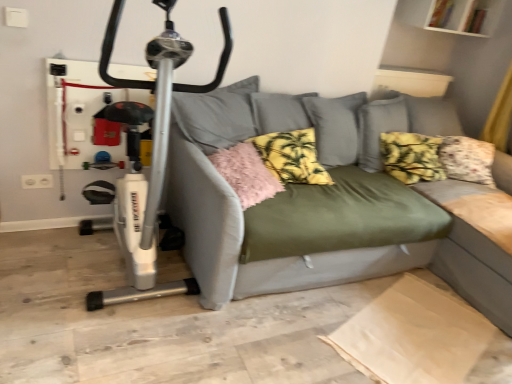
Image resolution: width=512 pixels, height=384 pixels. I want to click on olive green fabric couch at center, so click(328, 203).

Based on their sizes in the image, would you say yellow floral cushion at center, which ranks as the first pillow in right-to-left order, is bigger or smaller than pink fluffy pillow at center, which ranks as the first pillow in left-to-right order?

Clearly, yellow floral cushion at center, which ranks as the first pillow in right-to-left order, is larger in size than pink fluffy pillow at center, which ranks as the first pillow in left-to-right order.

Is yellow floral cushion at center, which ranks as the first pillow in right-to-left order, completely or partially outside of pink fluffy pillow at center, which ranks as the first pillow in left-to-right order?

Indeed, yellow floral cushion at center, which ranks as the first pillow in right-to-left order, is completely outside pink fluffy pillow at center, which ranks as the first pillow in left-to-right order.

From a real-world perspective, who is located higher, yellow floral cushion at center, which is counted as the third pillow, starting from the left, or pink fluffy pillow at center, which ranks as the first pillow in left-to-right order?

yellow floral cushion at center, which is counted as the third pillow, starting from the left, from a real-world perspective.

Is yellow floral cushion at center, which is counted as the third pillow, starting from the left, turned away from pink fluffy pillow at center, arranged as the 3th pillow when viewed from the right?

No, pink fluffy pillow at center, arranged as the 3th pillow when viewed from the right, is not at the back of yellow floral cushion at center, which is counted as the third pillow, starting from the left.

Which of these two, pink fluffy pillow at center, arranged as the 3th pillow when viewed from the right, or yellow floral cushion at center, which is counted as the third pillow, starting from the left, is wider?

With larger width is pink fluffy pillow at center, arranged as the 3th pillow when viewed from the right.

Is pink fluffy pillow at center, arranged as the 3th pillow when viewed from the right, with yellow floral cushion at center, which ranks as the first pillow in right-to-left order?

There is a gap between pink fluffy pillow at center, arranged as the 3th pillow when viewed from the right, and yellow floral cushion at center, which ranks as the first pillow in right-to-left order.

What's the angular difference between pink fluffy pillow at center, arranged as the 3th pillow when viewed from the right, and yellow floral cushion at center, which ranks as the first pillow in right-to-left order,'s facing directions?

19.8 degrees.

Does pink fluffy pillow at center, which ranks as the first pillow in left-to-right order, turn towards yellow floral cushion at center, which ranks as the first pillow in right-to-left order?

No, pink fluffy pillow at center, which ranks as the first pillow in left-to-right order, is not facing towards yellow floral cushion at center, which ranks as the first pillow in right-to-left order.

Measure the distance from white plastic exercise bike at left to olive green fabric couch at center.

A distance of 1.05 meters exists between white plastic exercise bike at left and olive green fabric couch at center.

In the scene shown: Is white plastic exercise bike at left in contact with olive green fabric couch at center?

white plastic exercise bike at left and olive green fabric couch at center are not in contact.

Which is less distant, (177, 66) or (284, 222)?

The point (284, 222) is closer to the camera.

Considering the relative sizes of white plastic exercise bike at left and olive green fabric couch at center in the image provided, is white plastic exercise bike at left shorter than olive green fabric couch at center?

No, white plastic exercise bike at left is not shorter than olive green fabric couch at center.

Looking at their sizes, would you say olive green fabric couch at center is wider or thinner than pink fluffy pillow at center, which ranks as the first pillow in left-to-right order?

Considering their sizes, olive green fabric couch at center looks broader than pink fluffy pillow at center, which ranks as the first pillow in left-to-right order.

From the image's perspective, which is above, olive green fabric couch at center or pink fluffy pillow at center, which ranks as the first pillow in left-to-right order?

pink fluffy pillow at center, which ranks as the first pillow in left-to-right order, is shown above in the image.

Does point (294, 109) lie behind point (265, 179)?

Yes, point (294, 109) is farther from viewer.

Is olive green fabric couch at center beside pink fluffy pillow at center, arranged as the 3th pillow when viewed from the right?

olive green fabric couch at center and pink fluffy pillow at center, arranged as the 3th pillow when viewed from the right, are not in contact.

Considering the relative sizes of yellow printed fabric pillow at center, which ranks as the second pillow in right-to-left order, and white plastic exercise bike at left in the image provided, is yellow printed fabric pillow at center, which ranks as the second pillow in right-to-left order, thinner than white plastic exercise bike at left?

Yes, yellow printed fabric pillow at center, which ranks as the second pillow in right-to-left order, is thinner than white plastic exercise bike at left.

Is white plastic exercise bike at left at the back of yellow printed fabric pillow at center, which appears as the second pillow when viewed from the left?

yellow printed fabric pillow at center, which appears as the second pillow when viewed from the left, is not turned away from white plastic exercise bike at left.

From a real-world perspective, is yellow printed fabric pillow at center, which appears as the second pillow when viewed from the left, on top of white plastic exercise bike at left?

Actually, yellow printed fabric pillow at center, which appears as the second pillow when viewed from the left, is physically below white plastic exercise bike at left in the real world.

Does yellow printed fabric pillow at center, which ranks as the second pillow in right-to-left order, have a larger size compared to white plastic exercise bike at left?

No.

Which object is thinner, yellow printed fabric pillow at center, which appears as the second pillow when viewed from the left, or yellow floral cushion at center, which ranks as the first pillow in right-to-left order?

Thinner between the two is yellow floral cushion at center, which ranks as the first pillow in right-to-left order.

Is point (260, 139) positioned in front of point (400, 175)?

That is True.

The image size is (512, 384). Identify the location of pillow located on the right of yellow printed fabric pillow at center, which appears as the second pillow when viewed from the left. (411, 157).

From the picture: Would you say pink fluffy pillow at center, which ranks as the first pillow in left-to-right order, is outside yellow printed fabric pillow at center, which appears as the second pillow when viewed from the left?

Indeed, pink fluffy pillow at center, which ranks as the first pillow in left-to-right order, is completely outside yellow printed fabric pillow at center, which appears as the second pillow when viewed from the left.

From a real-world perspective, is pink fluffy pillow at center, arranged as the 3th pillow when viewed from the right, located higher than yellow printed fabric pillow at center, which appears as the second pillow when viewed from the left?

Actually, pink fluffy pillow at center, arranged as the 3th pillow when viewed from the right, is physically below yellow printed fabric pillow at center, which appears as the second pillow when viewed from the left, in the real world.

Is pink fluffy pillow at center, arranged as the 3th pillow when viewed from the right, smaller than yellow printed fabric pillow at center, which ranks as the second pillow in right-to-left order?

Yes.

From the image's perspective, count 2nd pillows upward from the pink fluffy pillow at center, arranged as the 3th pillow when viewed from the right, and point to it. Please provide its 2D coordinates.

[(411, 157)]

From the pink fluffy pillow at center, which ranks as the first pillow in left-to-right order, count 2nd pillow to the right and point to it. Please provide its 2D coordinates.

[(411, 157)]

Estimate the real-world distances between objects in this image. Which object is closer to yellow floral cushion at center, which is counted as the third pillow, starting from the left, pink fluffy pillow at center, arranged as the 3th pillow when viewed from the right, or olive green fabric couch at center?

olive green fabric couch at center.

Based on their spatial positions, is white plastic exercise bike at left or yellow floral cushion at center, which ranks as the first pillow in right-to-left order, further from pink fluffy pillow at center, arranged as the 3th pillow when viewed from the right?

yellow floral cushion at center, which ranks as the first pillow in right-to-left order.

Looking at the image, which one is located closer to yellow floral cushion at center, which is counted as the third pillow, starting from the left, white plastic exercise bike at left or olive green fabric couch at center?

olive green fabric couch at center lies closer to yellow floral cushion at center, which is counted as the third pillow, starting from the left, than the other object.

Looking at this image, when comparing their distances from yellow floral cushion at center, which is counted as the third pillow, starting from the left, does olive green fabric couch at center or pink fluffy pillow at center, arranged as the 3th pillow when viewed from the right, seem closer?

Based on the image, olive green fabric couch at center appears to be nearer to yellow floral cushion at center, which is counted as the third pillow, starting from the left.

Based on their spatial positions, is white plastic exercise bike at left or olive green fabric couch at center closer to yellow printed fabric pillow at center, which appears as the second pillow when viewed from the left?

olive green fabric couch at center is closer to yellow printed fabric pillow at center, which appears as the second pillow when viewed from the left.

Based on the photo, which object lies nearer to the anchor point yellow printed fabric pillow at center, which appears as the second pillow when viewed from the left, white plastic exercise bike at left or yellow floral cushion at center, which is counted as the third pillow, starting from the left?

yellow floral cushion at center, which is counted as the third pillow, starting from the left.

Considering their positions, is pink fluffy pillow at center, which ranks as the first pillow in left-to-right order, positioned closer to yellow printed fabric pillow at center, which appears as the second pillow when viewed from the left, than yellow floral cushion at center, which is counted as the third pillow, starting from the left?

pink fluffy pillow at center, which ranks as the first pillow in left-to-right order, is closer to yellow printed fabric pillow at center, which appears as the second pillow when viewed from the left.

Considering their positions, is yellow printed fabric pillow at center, which appears as the second pillow when viewed from the left, positioned further to yellow floral cushion at center, which ranks as the first pillow in right-to-left order, than pink fluffy pillow at center, arranged as the 3th pillow when viewed from the right?

pink fluffy pillow at center, arranged as the 3th pillow when viewed from the right, is further to yellow floral cushion at center, which ranks as the first pillow in right-to-left order.

Locate an element on the screen. The width and height of the screenshot is (512, 384). studio couch between pink fluffy pillow at center, which ranks as the first pillow in left-to-right order, and yellow floral cushion at center, which is counted as the third pillow, starting from the left, from left to right is located at coordinates (328, 203).

Find the location of a particular element. The width and height of the screenshot is (512, 384). studio couch situated between white plastic exercise bike at left and yellow floral cushion at center, which is counted as the third pillow, starting from the left, from left to right is located at coordinates (328, 203).

Identify the location of pillow positioned between white plastic exercise bike at left and yellow printed fabric pillow at center, which appears as the second pillow when viewed from the left, from near to far. The image size is (512, 384). (246, 173).

The image size is (512, 384). In order to click on pillow between pink fluffy pillow at center, arranged as the 3th pillow when viewed from the right, and yellow floral cushion at center, which is counted as the third pillow, starting from the left, from left to right in this screenshot , I will do click(x=292, y=157).